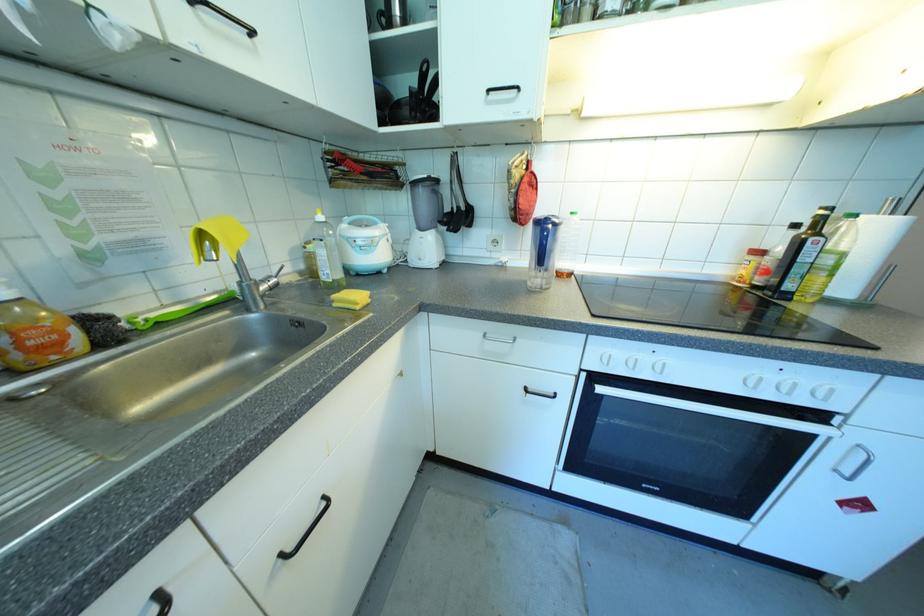
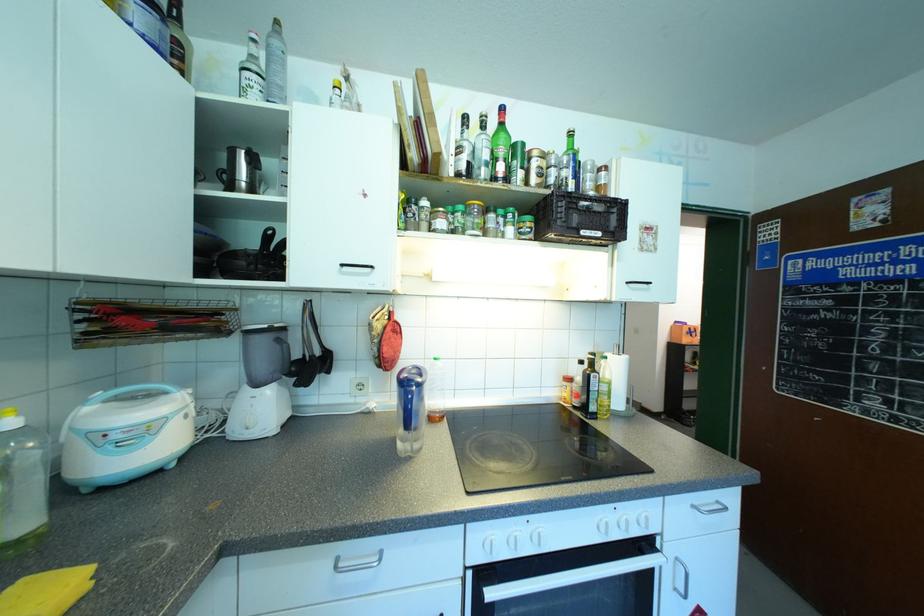
In the second image, find the point that corresponds to (x=528, y=161) in the first image.

(390, 313)